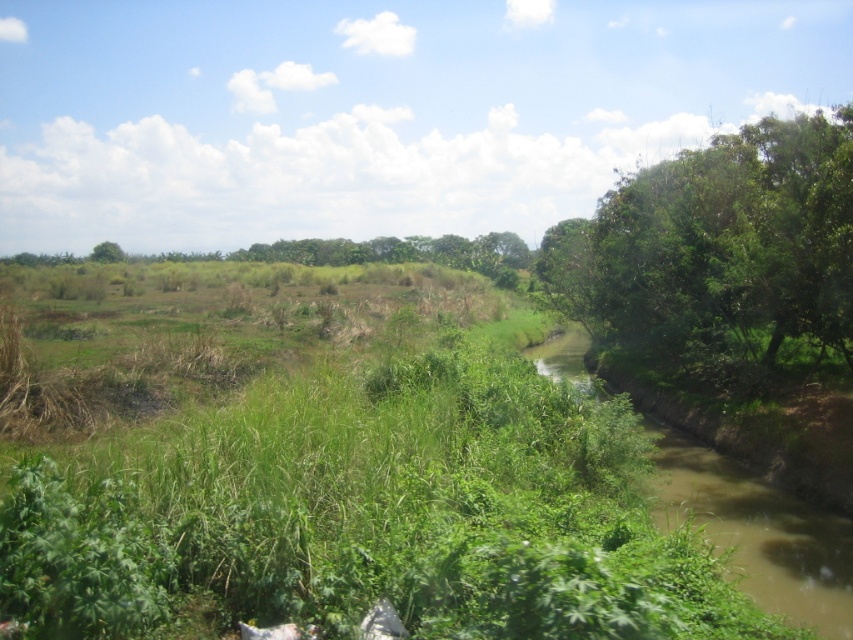
Question: Is green leafy tree at right smaller than green leafy tree at upper left?

Choices:
 (A) no
 (B) yes

Answer: (A)

Question: Does brown muddy water at right have a greater width compared to green leafy tree at upper left?

Choices:
 (A) yes
 (B) no

Answer: (B)

Question: Which of the following is the closest to the observer?

Choices:
 (A) green leafy tree at upper left
 (B) brown muddy water at right
 (C) green leafy tree at right

Answer: (B)

Question: Among these objects, which one is farthest from the camera?

Choices:
 (A) brown muddy water at right
 (B) green leafy tree at right

Answer: (B)

Question: Is green leafy tree at right to the left of green leafy tree at upper left from the viewer's perspective?

Choices:
 (A) yes
 (B) no

Answer: (B)

Question: Which object is positioned farthest from the green leafy tree at upper left?

Choices:
 (A) brown muddy water at right
 (B) green leafy tree at right

Answer: (A)